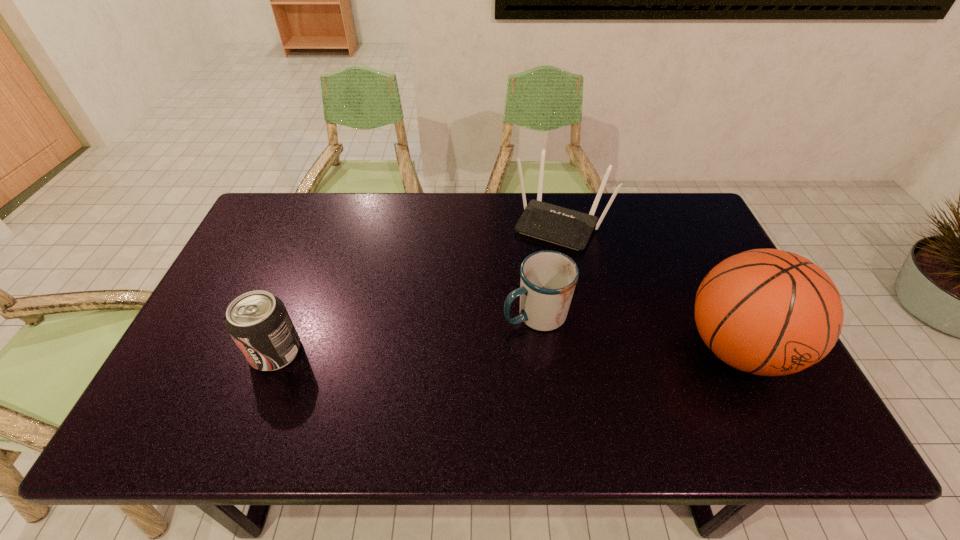
The height and width of the screenshot is (540, 960). What are the coordinates of `soda can` in the screenshot? It's located at (258, 322).

Identify the location of the tallest object. The image size is (960, 540). (769, 312).

Where is `the rightmost object`? This screenshot has width=960, height=540. the rightmost object is located at coordinates (769, 312).

This screenshot has height=540, width=960. I want to click on router, so click(569, 228).

The width and height of the screenshot is (960, 540). Identify the location of mug. (548, 278).

The image size is (960, 540). I want to click on free location located on the back of the soda can, so click(310, 262).

Image resolution: width=960 pixels, height=540 pixels. I want to click on vacant space located 0.050m on the back of the rightmost object, so click(709, 292).

Identify the location of free region located on the front-facing side of the router. click(x=520, y=295).

Identify the location of vacant space located on the front-facing side of the router. (517, 300).

Locate an element on the screen. vacant position located 0.330m on the front-facing side of the router is located at coordinates (501, 328).